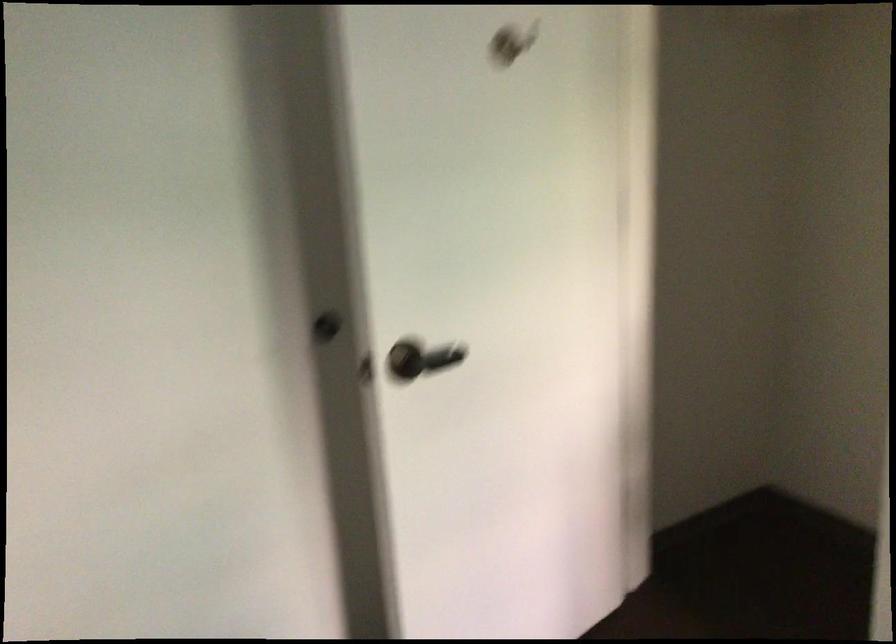
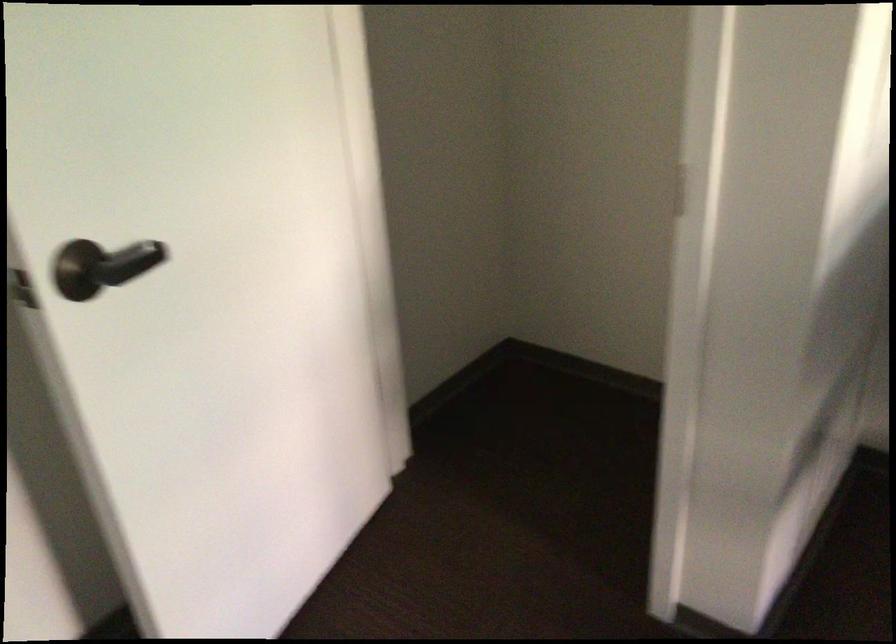
Question: How did the camera likely rotate?

Choices:
 (A) Left
 (B) Right
 (C) Up
 (D) Down

Answer: (B)